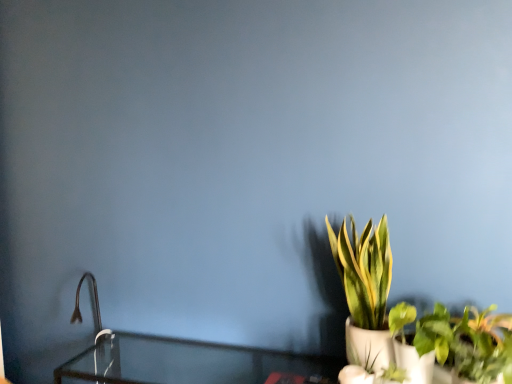
This screenshot has width=512, height=384. What do you see at coordinates (91, 306) in the screenshot? I see `matte black faucet at left` at bounding box center [91, 306].

Identify the location of green leafy plant in white pot at right. (365, 291).

From the image's perspective, which one is positioned lower, green leafy plant at lower right or green leafy plant in white pot at right?

green leafy plant at lower right.

How distant is green leafy plant at lower right from green leafy plant in white pot at right?

8.89 inches.

Is green leafy plant at lower right taller than green leafy plant in white pot at right?

No, green leafy plant at lower right is not taller than green leafy plant in white pot at right.

Does point (392, 368) come behind point (347, 334)?

No.

Based on the photo, considering the relative positions of green leafy plant in white pot at right and matte black faucet at left in the image provided, is green leafy plant in white pot at right to the right of matte black faucet at left from the viewer's perspective?

Indeed, green leafy plant in white pot at right is positioned on the right side of matte black faucet at left.

Is green leafy plant in white pot at right facing towards matte black faucet at left?

No, green leafy plant in white pot at right is not turned towards matte black faucet at left.

Is green leafy plant in white pot at right next to matte black faucet at left?

They are not placed beside each other.

Considering the sizes of objects matte black faucet at left and green leafy plant in white pot at right in the image provided, who is taller, matte black faucet at left or green leafy plant in white pot at right?

Standing taller between the two is green leafy plant in white pot at right.

Is matte black faucet at left completely or partially outside of green leafy plant in white pot at right?

matte black faucet at left lies outside green leafy plant in white pot at right's area.

Which is in front, matte black faucet at left or green leafy plant in white pot at right?

green leafy plant in white pot at right is closer to the camera.

Is matte black faucet at left not close to green leafy plant in white pot at right?

Yes.

From a real-world perspective, who is located higher, green leafy plant at lower right or matte black faucet at left?

matte black faucet at left is physically above.

From the picture: Considering the relative positions of green leafy plant at lower right and matte black faucet at left in the image provided, is green leafy plant at lower right behind matte black faucet at left?

No, green leafy plant at lower right is closer to the camera.

Considering the sizes of objects green leafy plant at lower right and matte black faucet at left in the image provided, who is taller, green leafy plant at lower right or matte black faucet at left?

matte black faucet at left is taller.

Which object is closer to the camera, green leafy plant in white pot at right or green leafy plant at lower right?

green leafy plant at lower right.

From a real-world perspective, is green leafy plant in white pot at right positioned above or below green leafy plant at lower right?

green leafy plant in white pot at right is situated higher than green leafy plant at lower right in the real world.

Can you confirm if matte black faucet at left is taller than green leafy plant at lower right?

Correct, matte black faucet at left is much taller as green leafy plant at lower right.

Is matte black faucet at left positioned with its back to green leafy plant at lower right?

No, matte black faucet at left's orientation is not away from green leafy plant at lower right.

At what (x,y) coordinates should I click in order to perform the action: click on plant that appears in front of the matte black faucet at left. Please return your answer as a coordinate pair (x, y). Looking at the image, I should click on (392, 374).

From a real-world perspective, between matte black faucet at left and green leafy plant at lower right, who is vertically higher?

In real-world perspective, matte black faucet at left is above.

Image resolution: width=512 pixels, height=384 pixels. I want to click on plant beneath the green leafy plant in white pot at right (from a real-world perspective), so click(x=392, y=374).

You are a GUI agent. You are given a task and a screenshot of the screen. Output one action in this format:
    pyautogui.click(x=<x>, y=<y>)
    Task: Click on the faucet that is below the green leafy plant in white pot at right (from the image's perspective)
    This screenshot has width=512, height=384.
    Given the screenshot: What is the action you would take?
    pyautogui.click(x=91, y=306)

When comparing their distances from green leafy plant in white pot at right, does green leafy plant at lower right or matte black faucet at left seem further?

Based on the image, matte black faucet at left appears to be further to green leafy plant in white pot at right.

Which object lies further to the anchor point green leafy plant at lower right, green leafy plant in white pot at right or matte black faucet at left?

matte black faucet at left is further to green leafy plant at lower right.

From the image, which object appears to be nearer to matte black faucet at left, green leafy plant at lower right or green leafy plant in white pot at right?

green leafy plant in white pot at right is closer to matte black faucet at left.

When comparing their distances from matte black faucet at left, does green leafy plant in white pot at right or green leafy plant at lower right seem closer?

The object closer to matte black faucet at left is green leafy plant in white pot at right.

Estimate the real-world distances between objects in this image. Which object is further from green leafy plant at lower right, matte black faucet at left or green leafy plant in white pot at right?

matte black faucet at left is further to green leafy plant at lower right.

Based on their spatial positions, is matte black faucet at left or green leafy plant at lower right further from green leafy plant in white pot at right?

matte black faucet at left lies further to green leafy plant in white pot at right than the other object.

The height and width of the screenshot is (384, 512). Identify the location of houseplant between matte black faucet at left and green leafy plant at lower right from left to right. (365, 291).